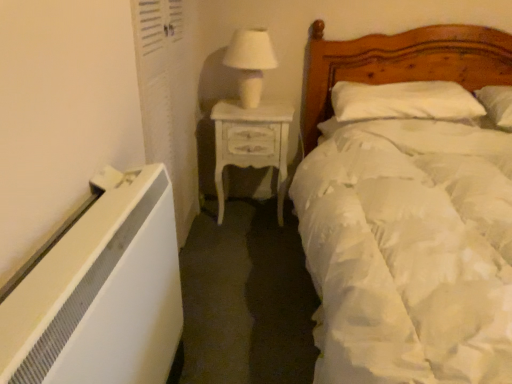
Question: Considering their positions, is white painted wood nightstand at center located in front of or behind white glossy table lamp at upper center?

Choices:
 (A) behind
 (B) front

Answer: (A)

Question: From a real-world perspective, is white painted wood nightstand at center positioned above or below white glossy table lamp at upper center?

Choices:
 (A) above
 (B) below

Answer: (B)

Question: Estimate the real-world distances between objects in this image. Which object is closer to the white glossy table lamp at upper center?

Choices:
 (A) white painted wood nightstand at center
 (B) wooden bed at right
 (C) white soft pillow at upper right

Answer: (A)

Question: Which is farther from the white glossy table lamp at upper center?

Choices:
 (A) wooden bed at right
 (B) white soft pillow at upper right
 (C) white painted wood nightstand at center

Answer: (A)